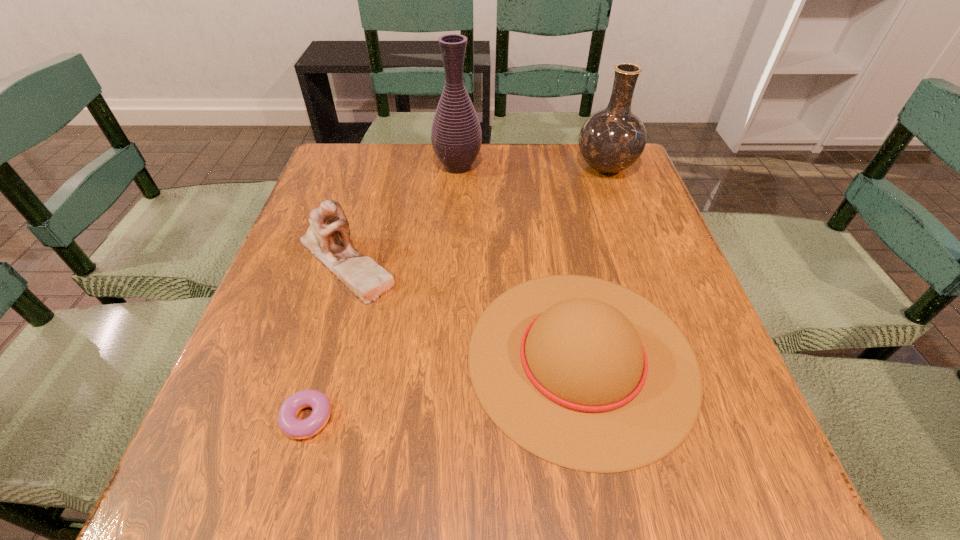
Where is `vacant area between the sombrero and the shortest object`? vacant area between the sombrero and the shortest object is located at coordinates (444, 390).

Image resolution: width=960 pixels, height=540 pixels. In order to click on empty location between the sombrero and the taller vase in this screenshot , I will do `click(520, 261)`.

Identify the location of free space between the doughnut and the figurine. The height and width of the screenshot is (540, 960). (325, 343).

Where is `free space between the doughnut and the second shortest object`? The image size is (960, 540). free space between the doughnut and the second shortest object is located at coordinates (444, 390).

Where is `object that is the second closest one to the figurine`? Image resolution: width=960 pixels, height=540 pixels. object that is the second closest one to the figurine is located at coordinates (456, 136).

Select which object is the second closest to the sombrero. Please provide its 2D coordinates. Your answer should be formatted as a tuple, i.e. [(x, y)], where the tuple contains the x and y coordinates of a point satisfying the conditions above.

[(291, 426)]

What are the coordinates of `vacant area in the image that satisfies the following two spatial constraints: 1. on the front-facing side of the sombrero; 2. on the left side of the third shortest object` in the screenshot? It's located at (317, 357).